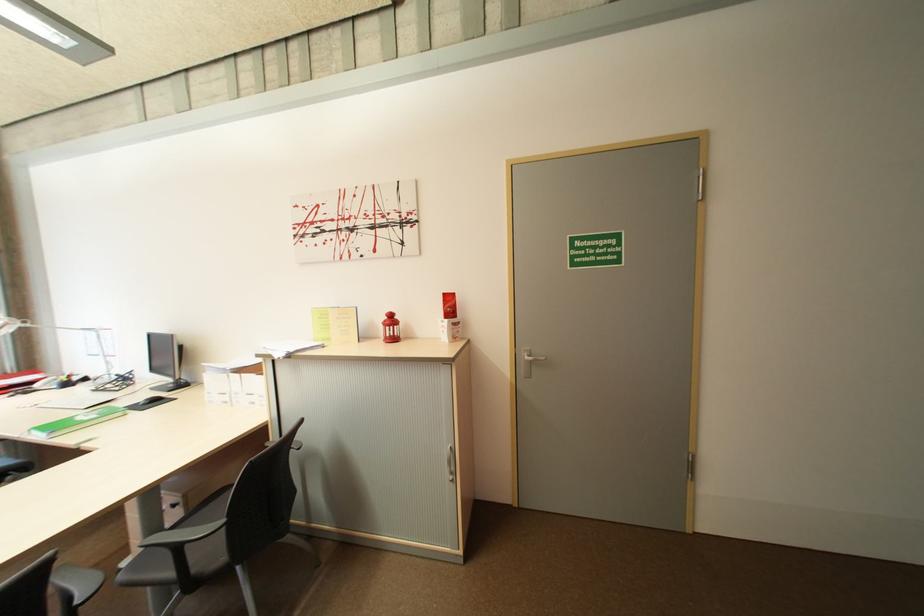
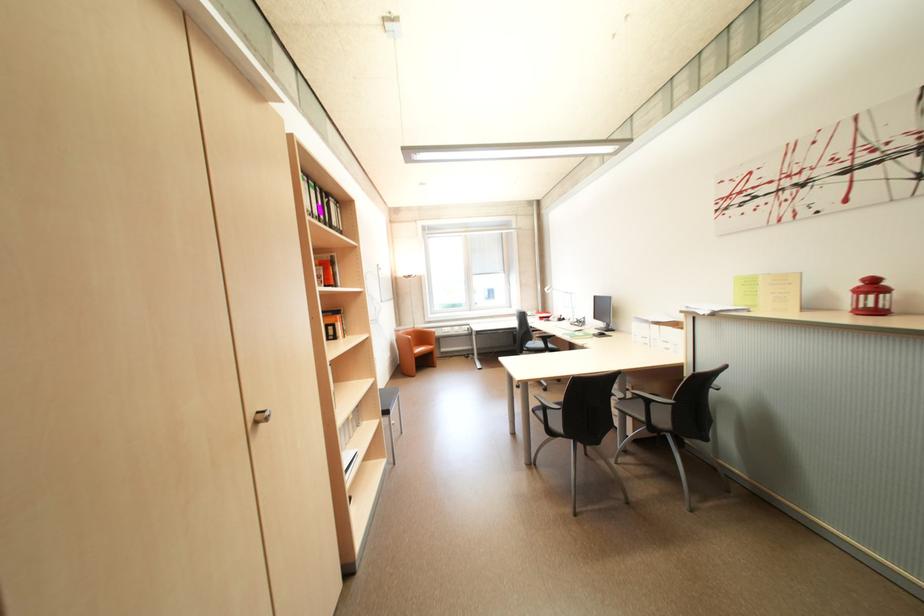
Question: The camera is either moving clockwise (left) or counter-clockwise (right) around the object. The first image is from the beginning of the video and the second image is from the end. Is the camera moving left or right when shooting the video?

Choices:
 (A) Left
 (B) Right

Answer: (B)